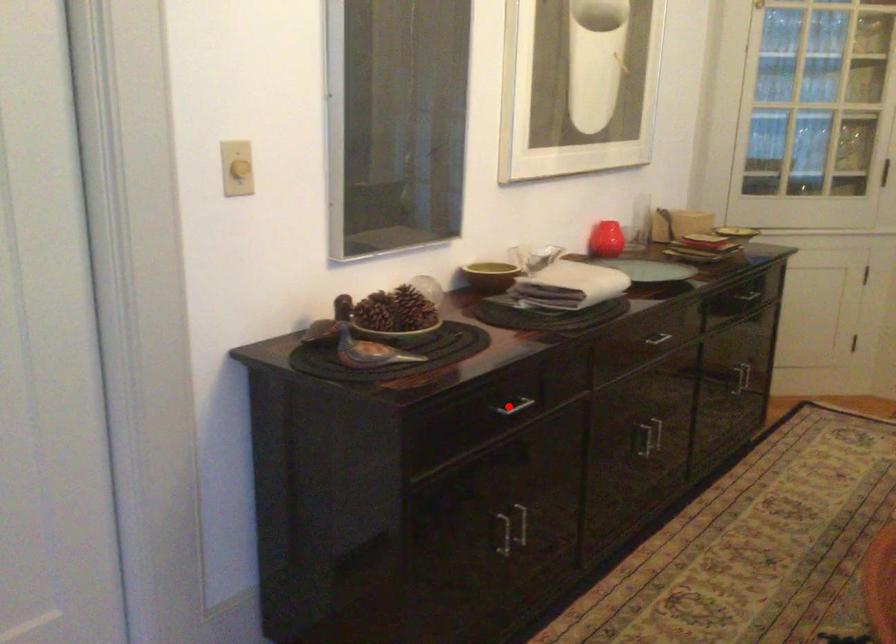
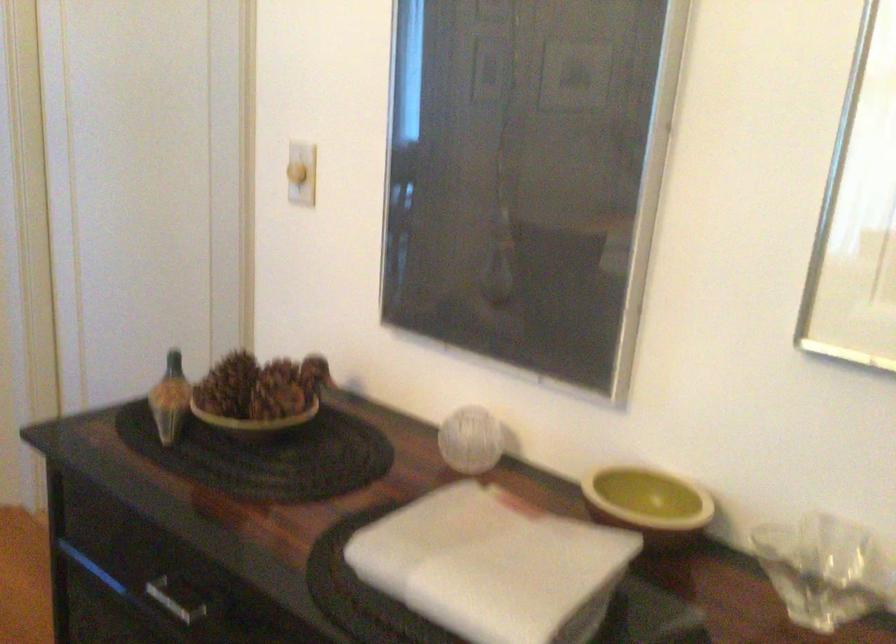
Question: I am providing you with two images of the same scene from different viewpoints. Image1 has a red point marked. In image2, the corresponding 3D location appears at what relative position? Reply with the corresponding letter.

Choices:
 (A) Closer
 (B) Farther

Answer: (A)